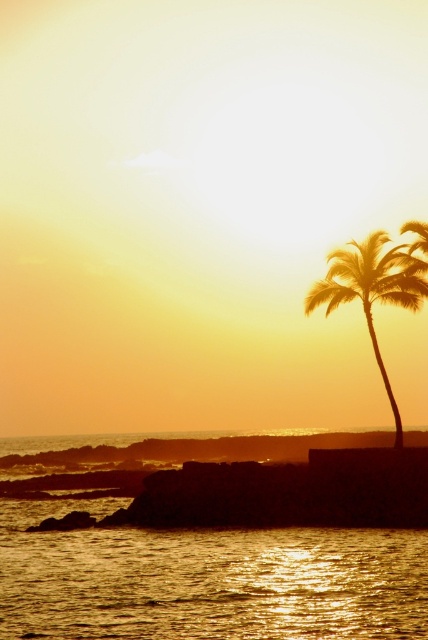
Question: Is golden reflective water at center to the right of silhouette palm tree at right from the viewer's perspective?

Choices:
 (A) no
 (B) yes

Answer: (A)

Question: Is golden reflective water at center smaller than silhouette palm tree at right?

Choices:
 (A) no
 (B) yes

Answer: (A)

Question: Can you confirm if golden reflective water at center is wider than silhouette palm tree at right?

Choices:
 (A) yes
 (B) no

Answer: (A)

Question: Among these objects, which one is farthest from the camera?

Choices:
 (A) golden reflective water at center
 (B) silhouette palm tree at right

Answer: (B)

Question: Among these objects, which one is farthest from the camera?

Choices:
 (A) golden reflective water at center
 (B) silhouette palm tree at right

Answer: (B)